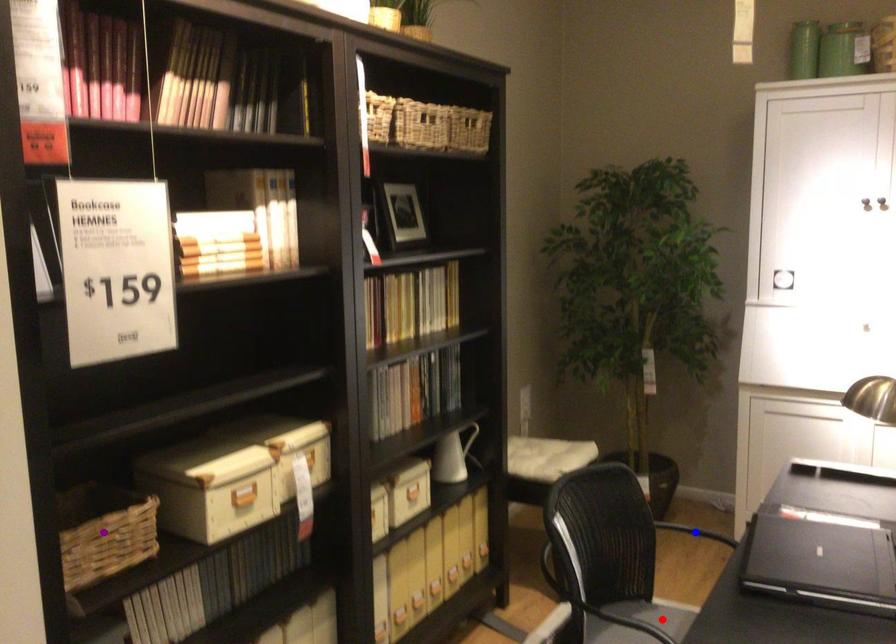
Order these from nearest to farthest:
- blue point
- red point
- purple point

purple point
red point
blue point